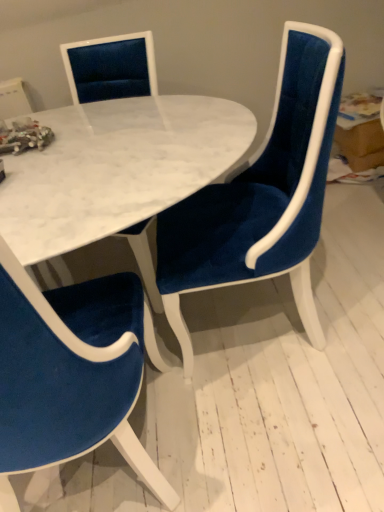
Question: Does velvet blue chair at lower left, positioned as the second chair in right-to-left order, have a lesser width compared to white marble table at center?

Choices:
 (A) no
 (B) yes

Answer: (A)

Question: Is velvet blue chair at lower left, positioned as the second chair in right-to-left order, taller than white marble table at center?

Choices:
 (A) yes
 (B) no

Answer: (A)

Question: Is velvet blue chair at lower left, placed as the 1th chair when sorted from left to right, bigger than white marble table at center?

Choices:
 (A) no
 (B) yes

Answer: (B)

Question: Considering the relative sizes of velvet blue chair at lower left, positioned as the second chair in right-to-left order, and white marble table at center in the image provided, is velvet blue chair at lower left, positioned as the second chair in right-to-left order, smaller than white marble table at center?

Choices:
 (A) yes
 (B) no

Answer: (B)

Question: Considering the relative positions of velvet blue chair at lower left, placed as the 1th chair when sorted from left to right, and white marble table at center in the image provided, is velvet blue chair at lower left, placed as the 1th chair when sorted from left to right, to the right of white marble table at center from the viewer's perspective?

Choices:
 (A) no
 (B) yes

Answer: (A)

Question: From the image's perspective, is white marble table at center located above or below velvet blue chair at lower left, positioned as the second chair in right-to-left order?

Choices:
 (A) above
 (B) below

Answer: (A)

Question: Is white marble table at center to the left or to the right of velvet blue chair at lower left, positioned as the second chair in right-to-left order, in the image?

Choices:
 (A) left
 (B) right

Answer: (B)

Question: Is white marble table at center spatially inside velvet blue chair at lower left, positioned as the second chair in right-to-left order, or outside of it?

Choices:
 (A) outside
 (B) inside

Answer: (A)

Question: Based on their sizes in the image, would you say white marble table at center is bigger or smaller than velvet blue chair at lower left, positioned as the second chair in right-to-left order?

Choices:
 (A) small
 (B) big

Answer: (A)

Question: Is velvet blue chair at lower left, positioned as the second chair in right-to-left order, taller or shorter than velvet blue chair at center, the 2th chair from the left?

Choices:
 (A) tall
 (B) short

Answer: (A)

Question: Does point (52, 296) appear closer or farther from the camera than point (226, 254)?

Choices:
 (A) farther
 (B) closer

Answer: (B)

Question: From the image's perspective, is velvet blue chair at lower left, placed as the 1th chair when sorted from left to right, located above or below velvet blue chair at center, the 1th chair viewed from the right?

Choices:
 (A) above
 (B) below

Answer: (B)

Question: In terms of width, does velvet blue chair at lower left, positioned as the second chair in right-to-left order, look wider or thinner when compared to velvet blue chair at center, the 2th chair from the left?

Choices:
 (A) thin
 (B) wide

Answer: (B)

Question: Considering their positions, is velvet blue chair at center, the 2th chair from the left, located in front of or behind white marble table at center?

Choices:
 (A) behind
 (B) front

Answer: (B)

Question: From a real-world perspective, is velvet blue chair at center, the 2th chair from the left, physically located above or below white marble table at center?

Choices:
 (A) below
 (B) above

Answer: (A)